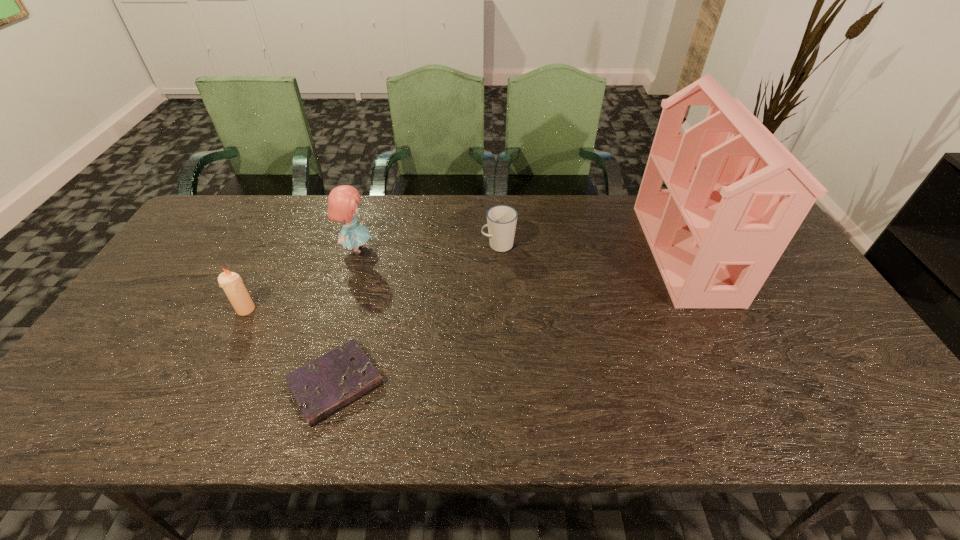
Where is `cup that is at the far edge`? cup that is at the far edge is located at coordinates pos(501,220).

Locate an element on the screen. This screenshot has width=960, height=540. object present at the near edge is located at coordinates (321, 387).

Identify the location of vacant space at the far edge of the desktop. This screenshot has width=960, height=540. (587, 200).

At what (x,y) coordinates should I click in order to perform the action: click on free location at the near edge. Please return your answer as a coordinate pair (x, y). Image resolution: width=960 pixels, height=540 pixels. Looking at the image, I should click on (743, 434).

Locate an element on the screen. Image resolution: width=960 pixels, height=540 pixels. vacant space at the left edge of the desktop is located at coordinates (184, 270).

The width and height of the screenshot is (960, 540). In the image, there is a desktop. What are the coordinates of `vacant space at the right edge` in the screenshot? It's located at (877, 386).

The height and width of the screenshot is (540, 960). Identify the location of empty location between the second object from right to left and the shortest object. (417, 314).

This screenshot has height=540, width=960. I want to click on free area in between the second tallest object and the tallest object, so click(520, 251).

This screenshot has height=540, width=960. Identify the location of vacant space in between the tallest object and the second shortest object. (591, 249).

The width and height of the screenshot is (960, 540). In order to click on free space between the leftmost object and the nearest object in this screenshot , I will do `click(291, 347)`.